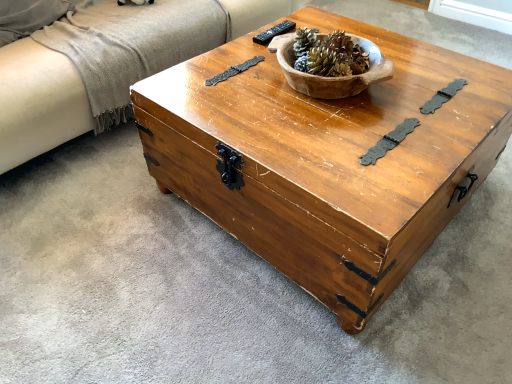
Question: From a real-world perspective, is wooden bowl at center positioned under black plastic remote at upper center based on gravity?

Choices:
 (A) no
 (B) yes

Answer: (A)

Question: Is wooden bowl at center closer to the viewer compared to black plastic remote at upper center?

Choices:
 (A) yes
 (B) no

Answer: (A)

Question: Considering the relative sizes of wooden bowl at center and black plastic remote at upper center in the image provided, is wooden bowl at center taller than black plastic remote at upper center?

Choices:
 (A) yes
 (B) no

Answer: (A)

Question: From a real-world perspective, is wooden bowl at center positioned over black plastic remote at upper center based on gravity?

Choices:
 (A) no
 (B) yes

Answer: (B)

Question: Is wooden bowl at center outside black plastic remote at upper center?

Choices:
 (A) yes
 (B) no

Answer: (A)

Question: From a real-world perspective, relative to wooden chest at center, is wooden bowl at center vertically above or below?

Choices:
 (A) above
 (B) below

Answer: (A)

Question: Looking at their shapes, would you say wooden bowl at center is wider or thinner than wooden chest at center?

Choices:
 (A) wide
 (B) thin

Answer: (B)

Question: From the image's perspective, is wooden bowl at center positioned above or below wooden chest at center?

Choices:
 (A) above
 (B) below

Answer: (A)

Question: Is point (292, 46) positioned closer to the camera than point (223, 188)?

Choices:
 (A) closer
 (B) farther

Answer: (B)

Question: In the image, is black plastic remote at upper center positioned in front of or behind beige fabric couch at left?

Choices:
 (A) behind
 (B) front

Answer: (A)

Question: Considering the positions of black plastic remote at upper center and beige fabric couch at left in the image, is black plastic remote at upper center wider or thinner than beige fabric couch at left?

Choices:
 (A) thin
 (B) wide

Answer: (A)

Question: Considering the relative positions of black plastic remote at upper center and beige fabric couch at left in the image provided, is black plastic remote at upper center to the left or to the right of beige fabric couch at left?

Choices:
 (A) left
 (B) right

Answer: (B)

Question: From a real-world perspective, relative to beige fabric couch at left, is black plastic remote at upper center vertically above or below?

Choices:
 (A) below
 (B) above

Answer: (B)

Question: In terms of width, does beige fabric couch at left look wider or thinner when compared to black plastic remote at upper center?

Choices:
 (A) wide
 (B) thin

Answer: (A)

Question: Considering their positions, is beige fabric couch at left located in front of or behind black plastic remote at upper center?

Choices:
 (A) front
 (B) behind

Answer: (A)